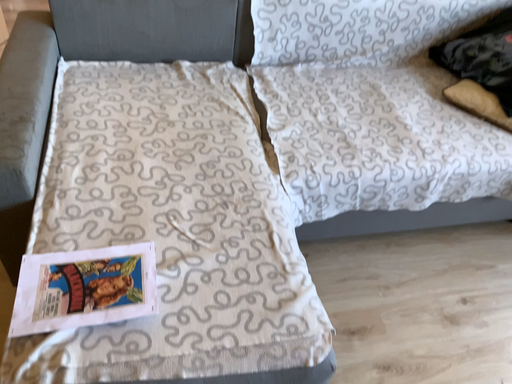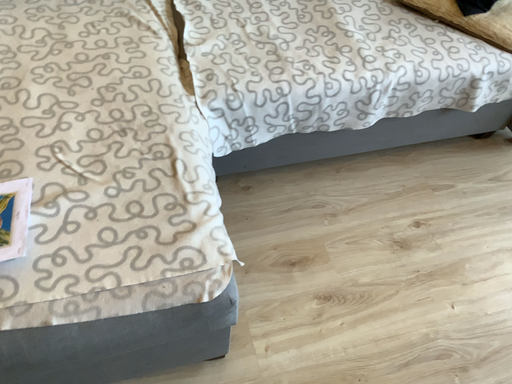
Question: How did the camera likely rotate when shooting the video?

Choices:
 (A) rotated upward
 (B) rotated downward

Answer: (B)